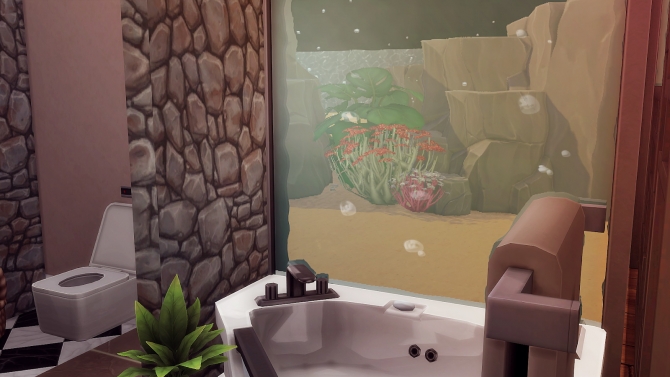
I want to click on tan towel, so click(x=553, y=241).